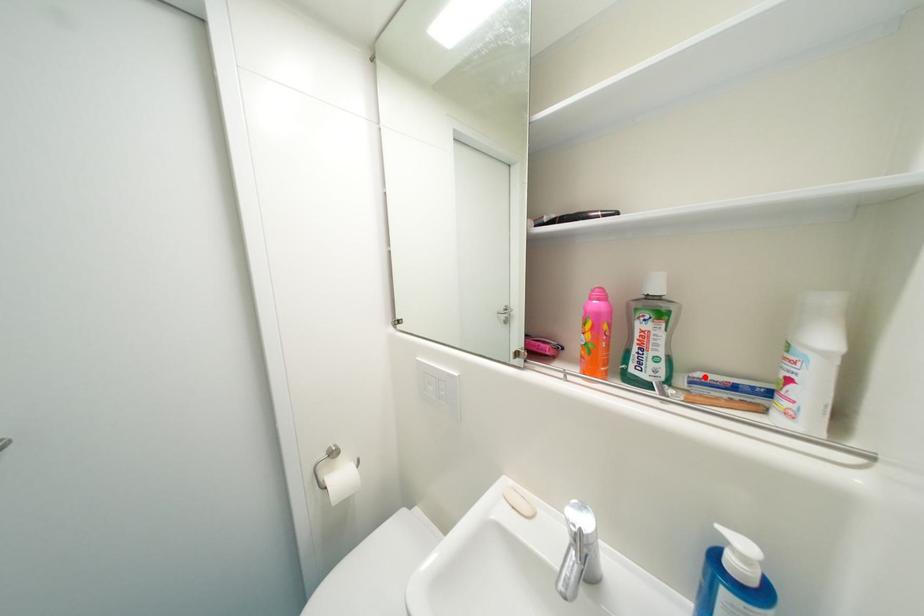
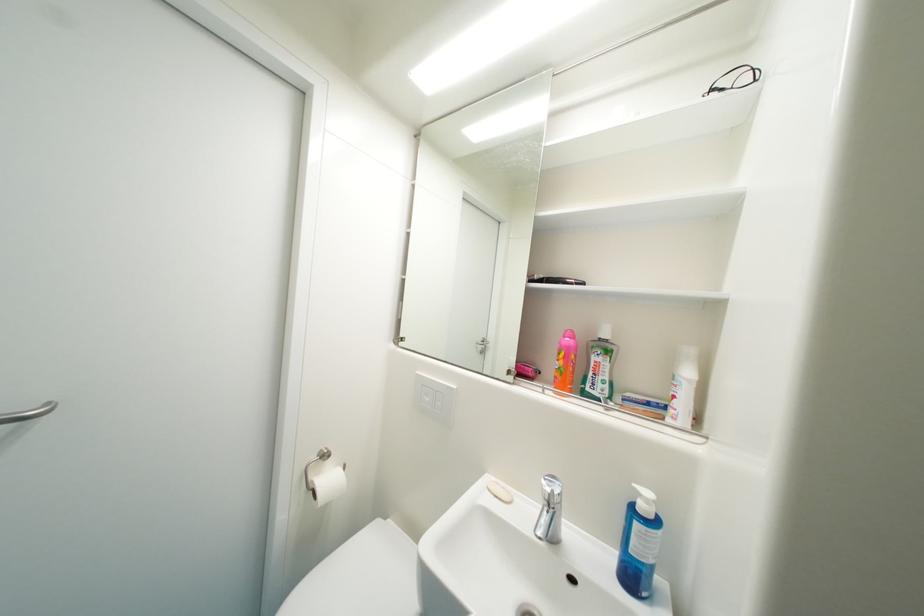
Where in the second image is the point corresponding to the highlighted location from the first image?

(635, 397)